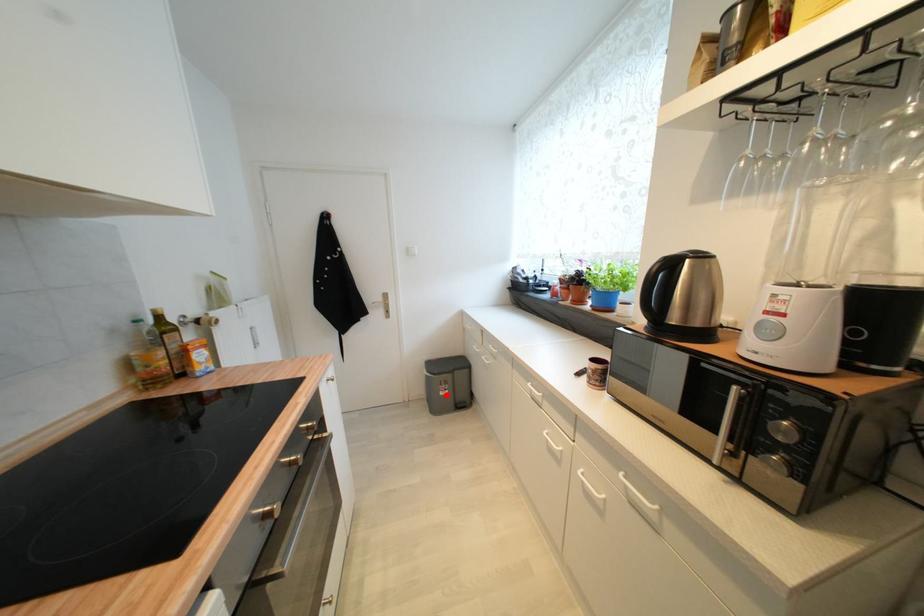
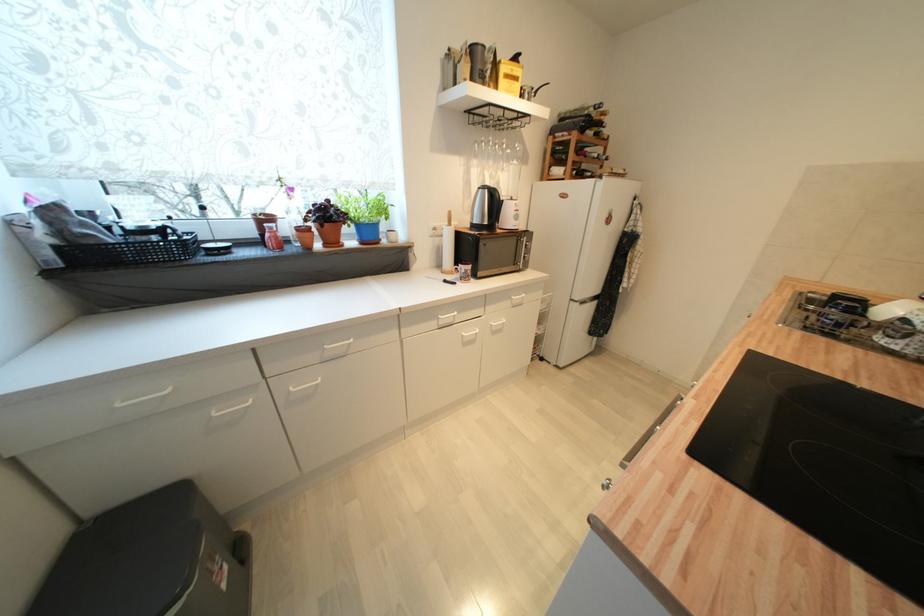
Where in the second image is the point corresponding to the highlighted location from the first image?

(228, 588)